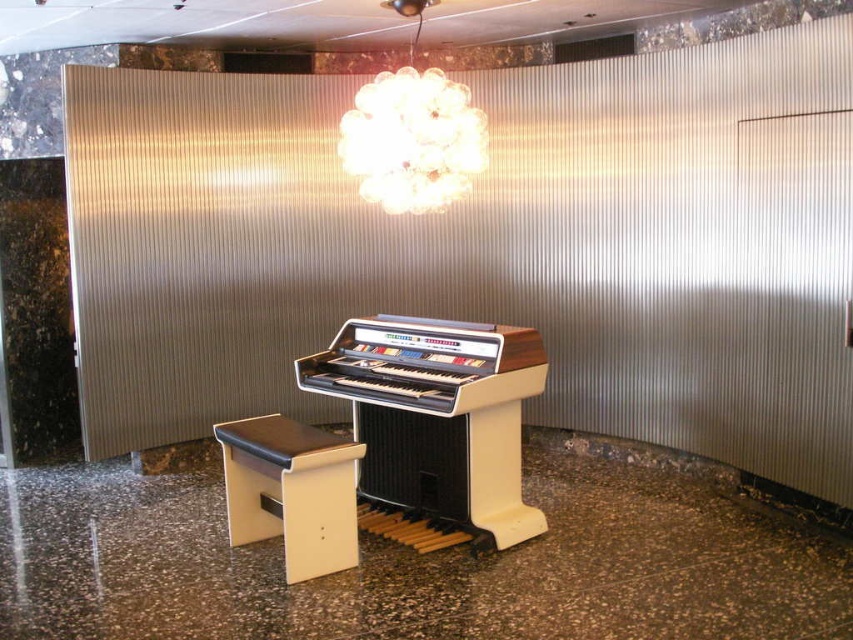
Looking at this image, is white plastic organ at center to the right of translucent glass globe at upper center from the viewer's perspective?

Indeed, white plastic organ at center is positioned on the right side of translucent glass globe at upper center.

Between white plastic organ at center and translucent glass globe at upper center, which one appears on the right side from the viewer's perspective?

Positioned to the right is white plastic organ at center.

Is point (433, 388) in front of point (471, 113)?

Yes, point (433, 388) is in front of point (471, 113).

Locate an element on the screen. white plastic organ at center is located at coordinates (437, 416).

Does translucent glass globe at upper center have a greater height compared to beige leather music stool at center?

Indeed, translucent glass globe at upper center has a greater height compared to beige leather music stool at center.

Between translucent glass globe at upper center and beige leather music stool at center, which one is positioned higher?

translucent glass globe at upper center is higher up.

Find the location of `translucent glass globe at upper center`. translucent glass globe at upper center is located at coordinates click(412, 132).

Locate an element on the screen. This screenshot has width=853, height=640. translucent glass globe at upper center is located at coordinates (412, 132).

Is white plastic organ at center positioned at the back of beige leather music stool at center?

That is True.

Does white plastic organ at center lie in front of beige leather music stool at center?

That is False.

Measure the distance between white plastic organ at center and camera.

white plastic organ at center is 3.55 meters away from camera.

At what (x,y) coordinates should I click in order to perform the action: click on white plastic organ at center. Please return your answer as a coordinate pair (x, y). Looking at the image, I should click on (437, 416).